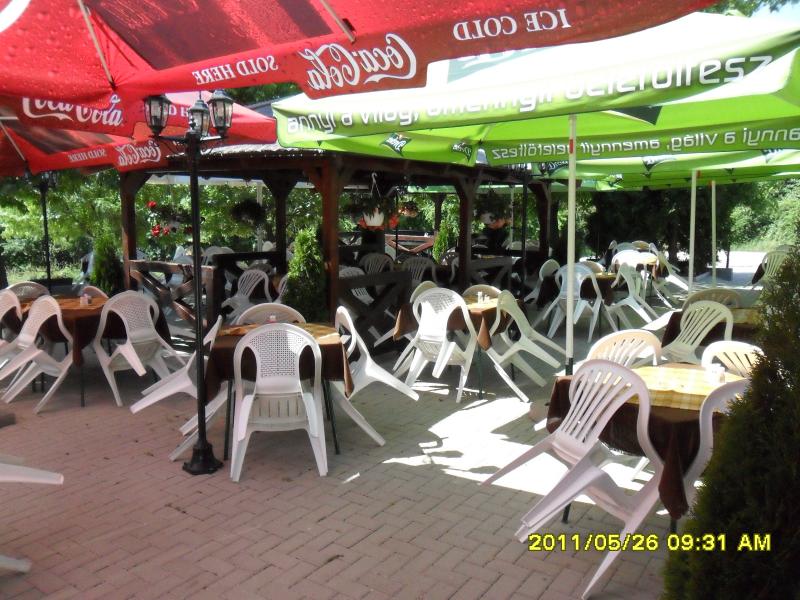
Image resolution: width=800 pixels, height=600 pixels. I want to click on lamp, so click(201, 120).